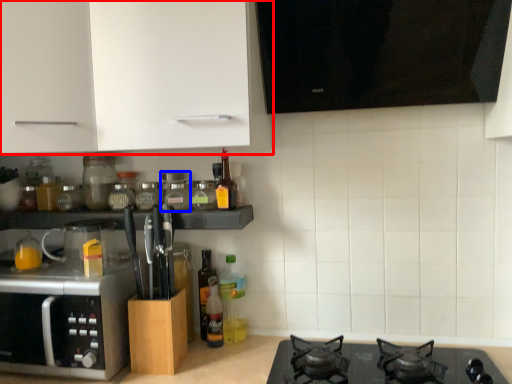
Question: Which object appears closest to the camera in this image, cabinetry (highlighted by a red box) or glass jar (highlighted by a blue box)?

Choices:
 (A) cabinetry
 (B) glass jar

Answer: (A)